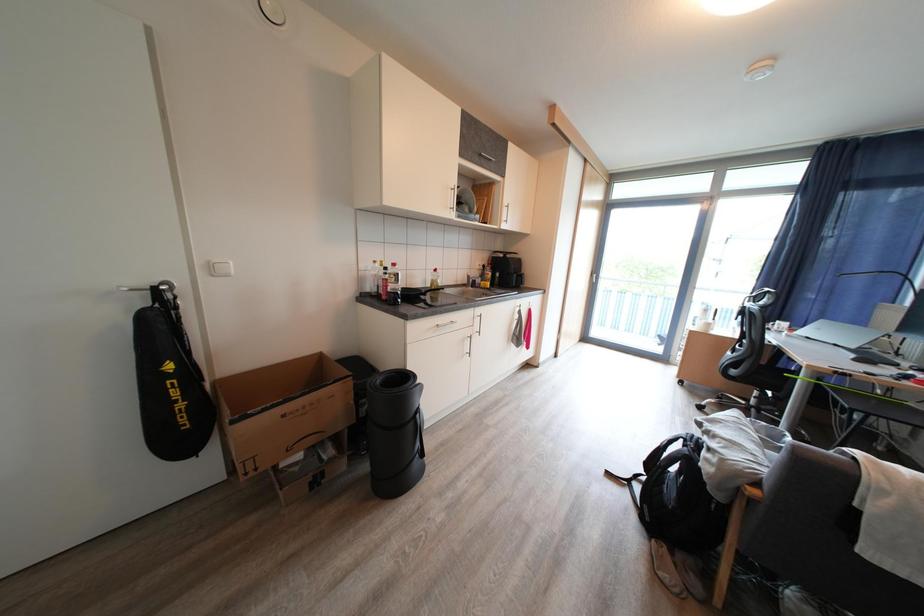
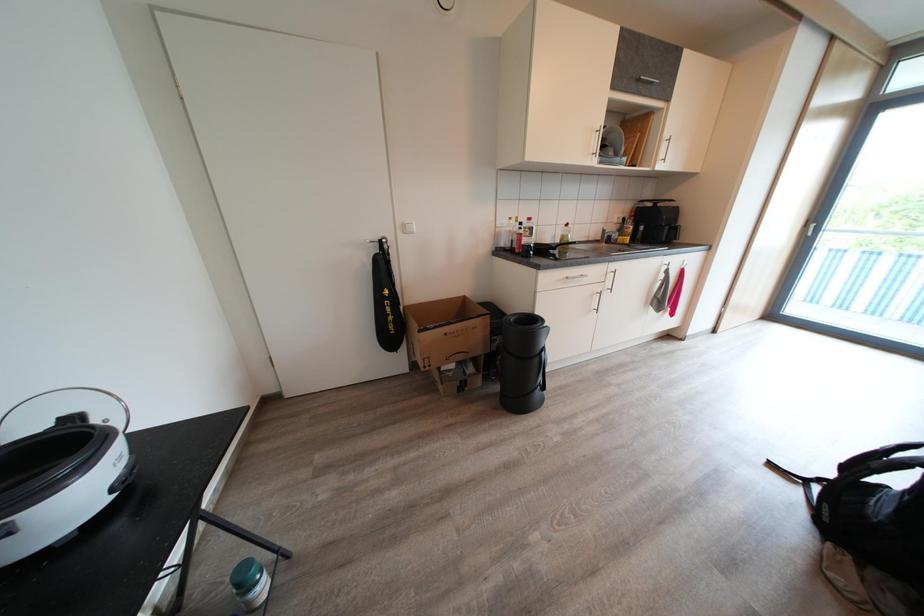
Question: In a continuous first-person perspective shot, in which direction is the camera moving?

Choices:
 (A) Left
 (B) Right
 (C) Forward
 (D) Backward

Answer: (D)